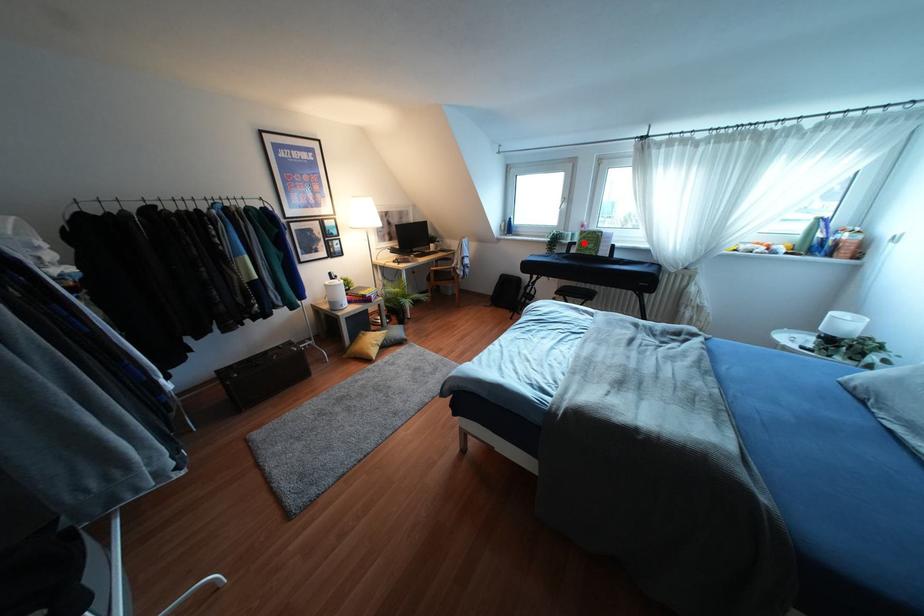
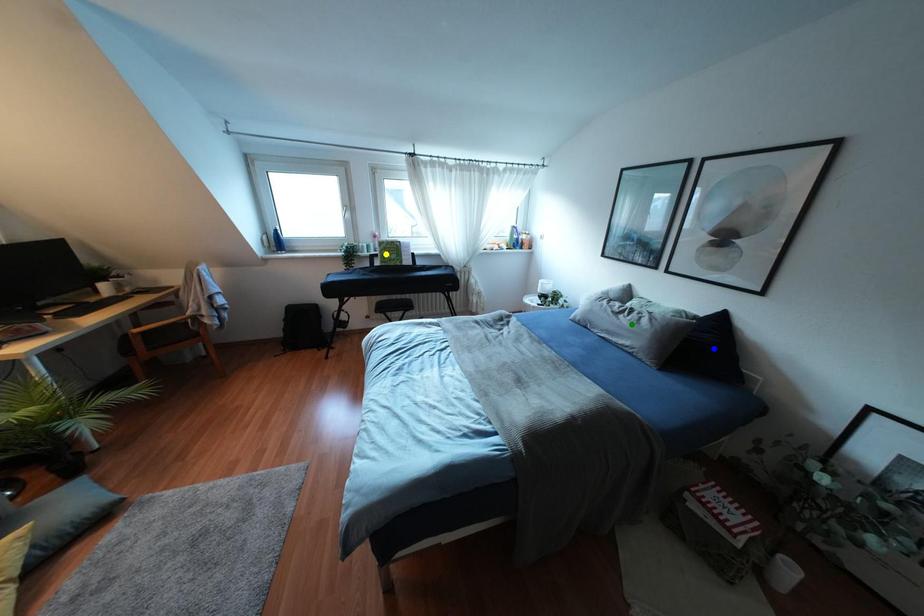
Question: I am providing you with two images of the same scene from different viewpoints. A red point is marked on the first image. You are given multiple points on the second image. Which point in image 2 represents the same 3d spot as the red point in image 1?

Choices:
 (A) yellow point
 (B) blue point
 (C) green point

Answer: (A)